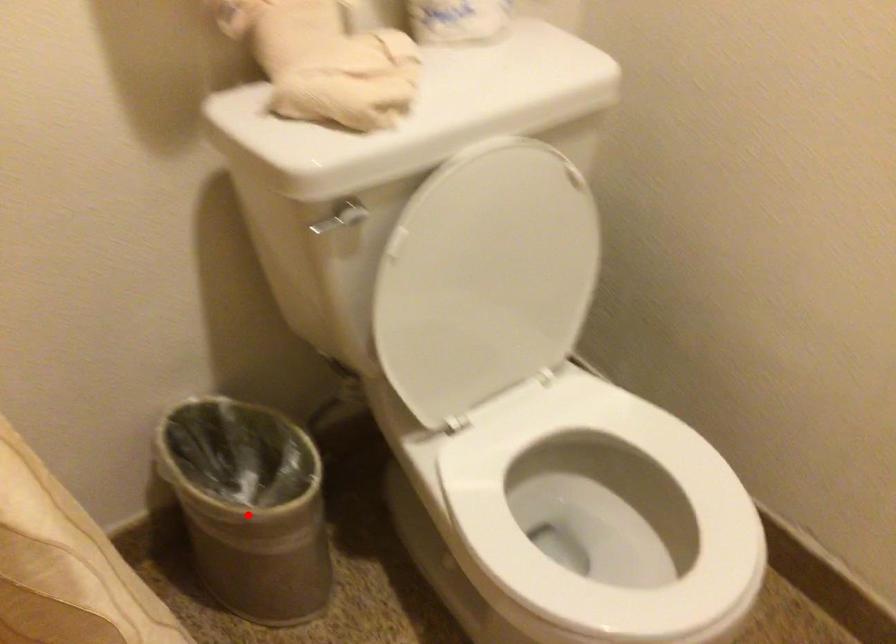
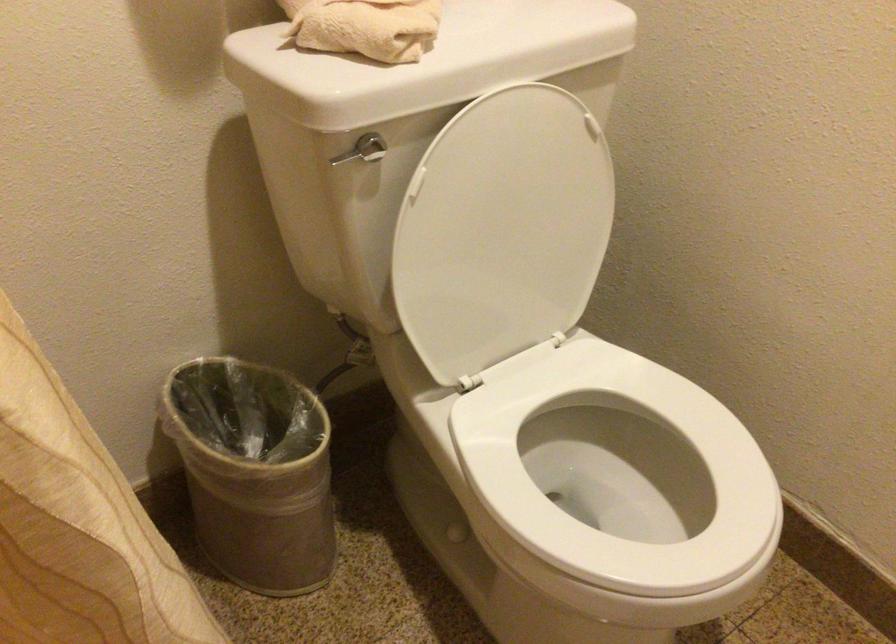
Find the pixel in the second image that matches the highlighted location in the first image.

(254, 471)